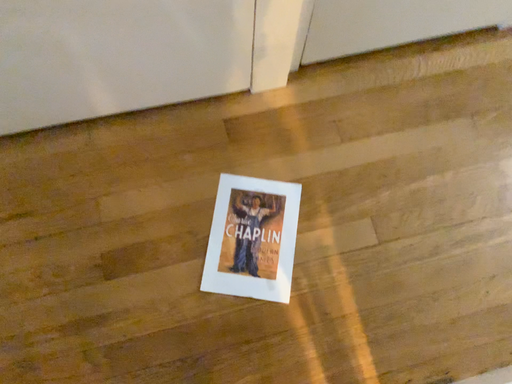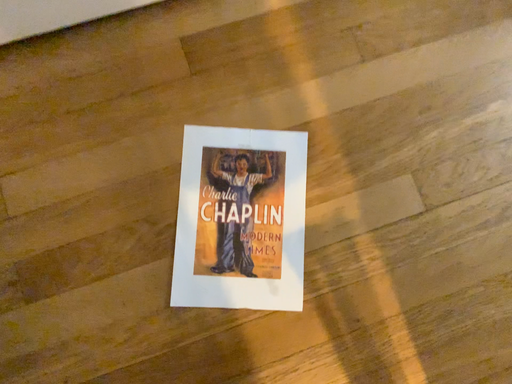
Question: How did the camera likely rotate when shooting the video?

Choices:
 (A) rotated upward
 (B) rotated downward

Answer: (B)